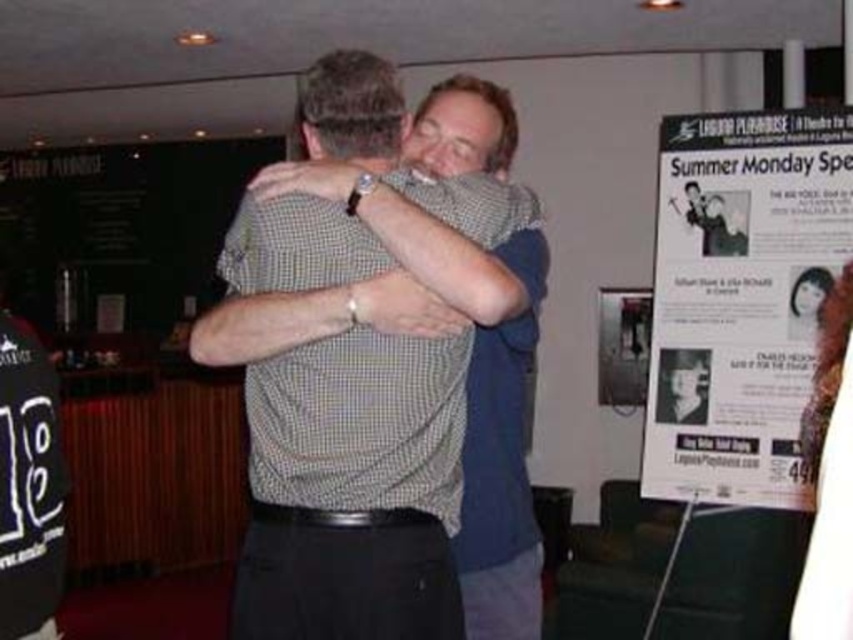
Does checkered fabric shirt at center have a smaller size compared to smooth black hair at upper right?

Actually, checkered fabric shirt at center might be larger than smooth black hair at upper right.

Can you confirm if checkered fabric shirt at center is bigger than smooth black hair at upper right?

Indeed, checkered fabric shirt at center has a larger size compared to smooth black hair at upper right.

The image size is (853, 640). Find the location of `checkered fabric shirt at center`. checkered fabric shirt at center is located at coordinates (339, 429).

Where is `checkered fabric shirt at center`? checkered fabric shirt at center is located at coordinates (339, 429).

Can you confirm if white paper poster at right is wider than smooth black hair at upper right?

Yes.

Measure the distance between white paper poster at right and camera.

They are 3.28 meters apart.

Is point (676, 321) positioned in front of point (796, 317)?

No, (676, 321) is further to viewer.

Identify the location of white paper poster at right. This screenshot has width=853, height=640. (738, 298).

Is checkered fabric shirt at center below white paper poster at right?

Yes, checkered fabric shirt at center is below white paper poster at right.

Describe the element at coordinates (339, 429) in the screenshot. The width and height of the screenshot is (853, 640). I see `checkered fabric shirt at center` at that location.

Measure the distance between checkered fabric shirt at center and camera.

5.10 feet

I want to click on checkered fabric shirt at center, so click(x=339, y=429).